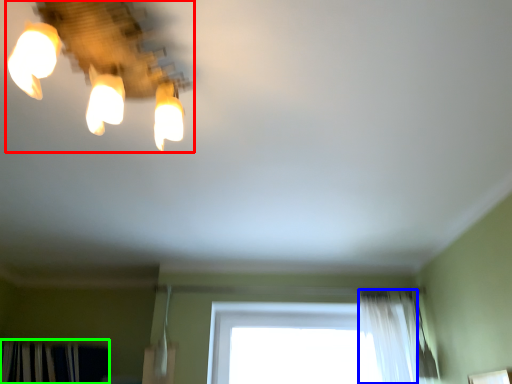
Question: Based on their relative distances, which object is nearer to lamp (highlighted by a red box)? Choose from shower curtain (highlighted by a blue box) and curtain (highlighted by a green box).

Choices:
 (A) shower curtain
 (B) curtain

Answer: (A)